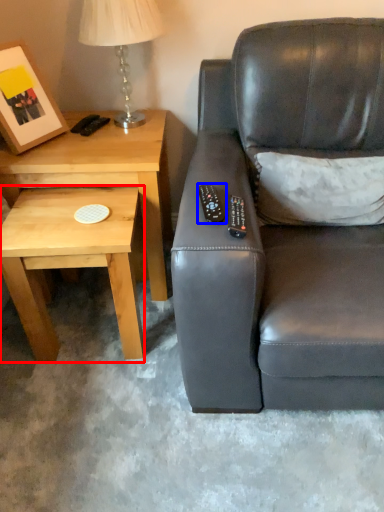
Question: Which point is closer to the camera, coffee table (highlighted by a red box) or remote (highlighted by a blue box)?

Choices:
 (A) coffee table
 (B) remote

Answer: (B)